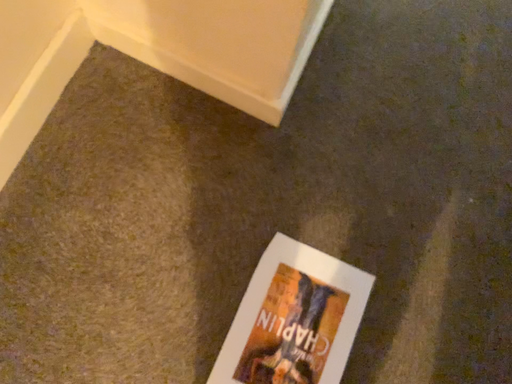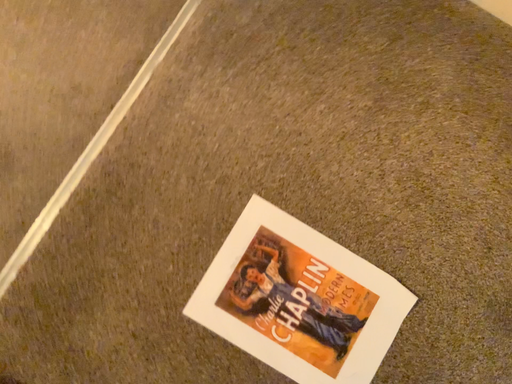
Question: Which way did the camera rotate in the video?

Choices:
 (A) rotated right
 (B) rotated left

Answer: (B)